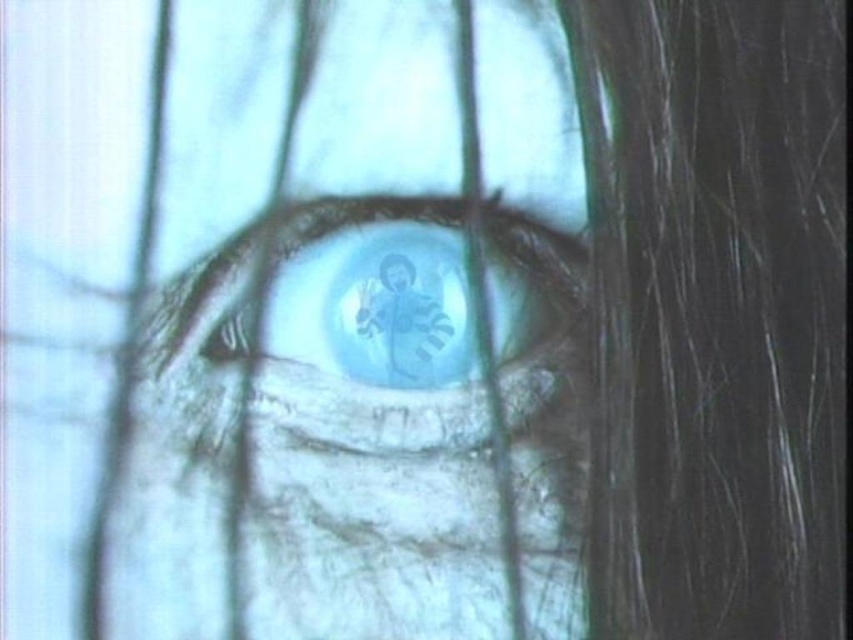
From the picture: Between translucent glass eye at center and translucent blue eye at center, which one is positioned higher?

Positioned higher is translucent blue eye at center.

The width and height of the screenshot is (853, 640). Describe the element at coordinates (373, 419) in the screenshot. I see `translucent glass eye at center` at that location.

Is point (418, 278) farther from viewer compared to point (160, 314)?

Yes, point (418, 278) is behind point (160, 314).

Identify the location of translucent glass eye at center. This screenshot has height=640, width=853. (373, 419).